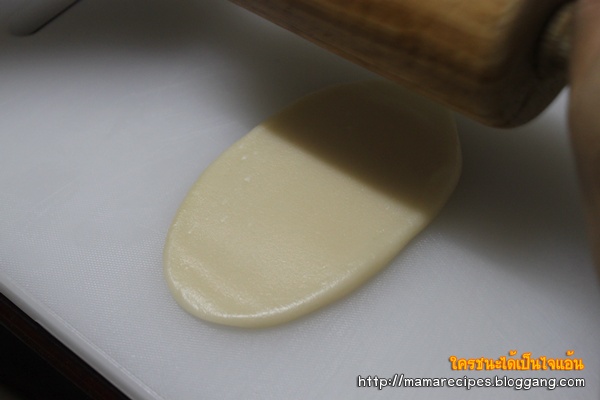
The height and width of the screenshot is (400, 600). Identify the location of rolling pin shadow. (199, 32), (277, 80), (360, 122), (434, 168), (495, 200).